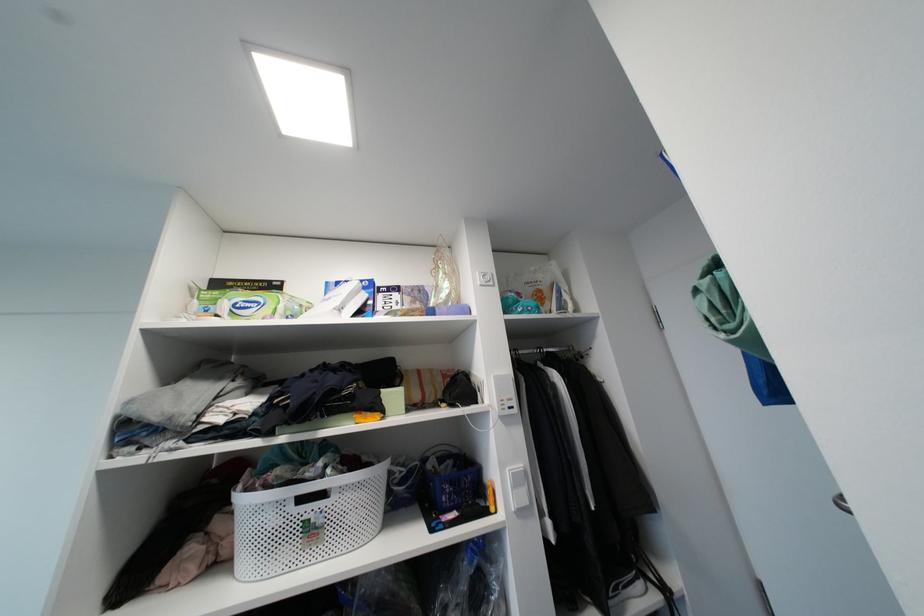
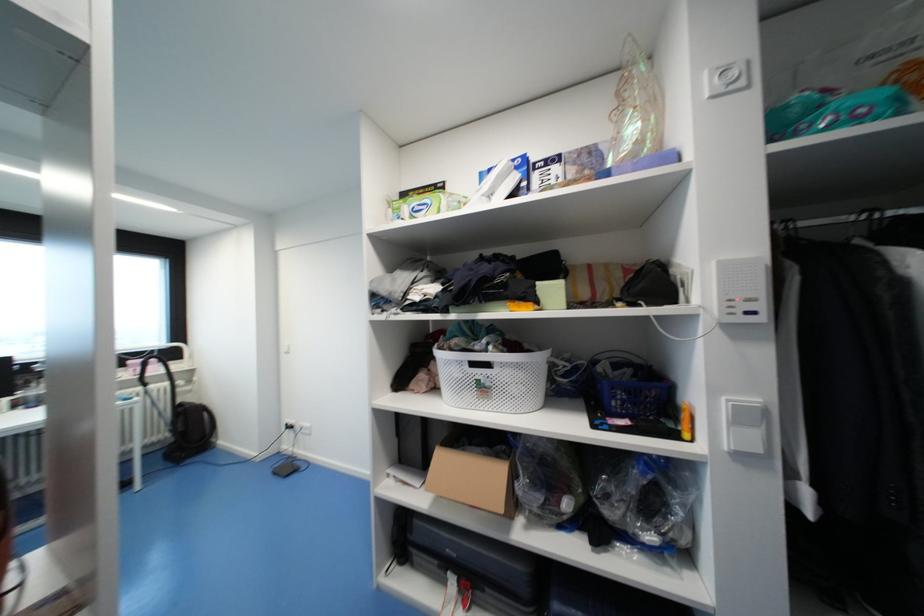
In the second image, find the point that corresponds to the point at 495,284 in the first image.

(747, 84)